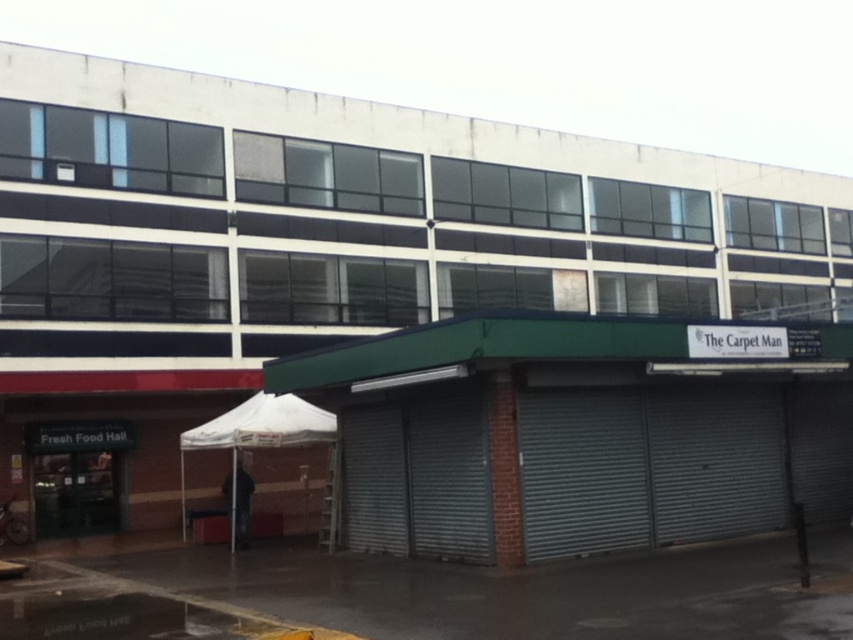
You are a delivery person trying to find the entrance to the building. You see a gray metallic garage door at center and a white fabric canopy at lower left. Which object is positioned to the right side from your perspective?

The gray metallic garage door at center is to the right of the white fabric canopy at lower left.

You are a delivery person trying to access the gray metallic garage door at center to drop off a package. However, there is a white fabric canopy at lower left above it. Can you drive your delivery van directly under the canopy to reach the garage door without going under the canopy?

The gray metallic garage door at center is located below the white fabric canopy at lower left, so you can drive your delivery van directly under the canopy to reach the garage door without needing to go around it.

From the picture: You are a delivery person trying to park your van in front of the building. The van is 2 meters wide. There is a gray metallic garage door at center and a white fabric canopy at lower left. Which object provides enough space for your van to park without touching either side?

The gray metallic garage door at center has a larger width than the white fabric canopy at lower left, so the van can park next to the gray metallic garage door at center without touching either side.